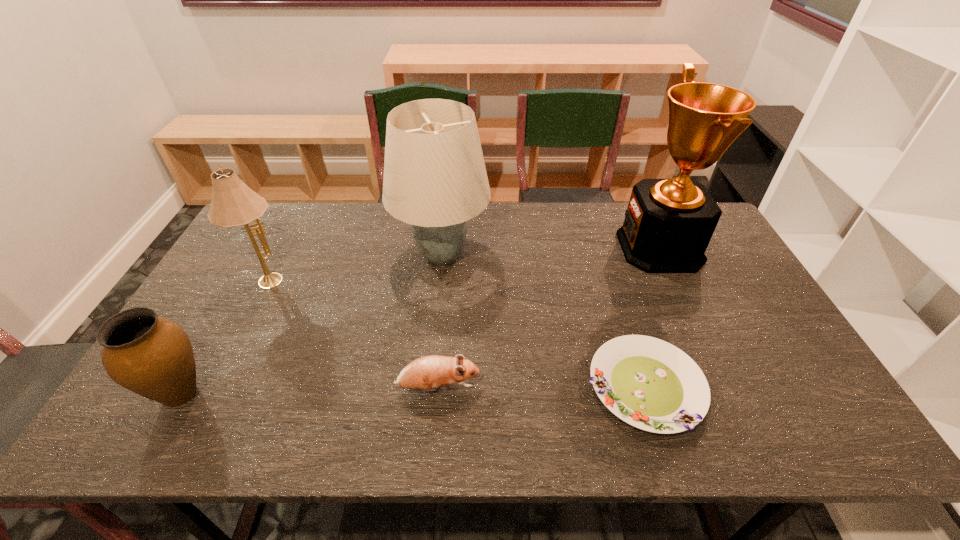
The image size is (960, 540). Identify the location of free point between the taller lampshade and the salad plate. (543, 321).

Find the location of `unoccupied position between the shorter lampshade and the fifth tallest object`. unoccupied position between the shorter lampshade and the fifth tallest object is located at coordinates (352, 333).

Image resolution: width=960 pixels, height=540 pixels. Find the location of `empty location between the shorter lampshade and the taller lampshade`. empty location between the shorter lampshade and the taller lampshade is located at coordinates (354, 267).

Find the location of a particular element. The image size is (960, 540). free space between the trophy cup and the hamster is located at coordinates (548, 318).

I want to click on vacant area that lies between the right lampshade and the third tallest object, so click(354, 267).

Locate an element on the screen. The width and height of the screenshot is (960, 540). free area in between the shortest object and the left lampshade is located at coordinates (456, 333).

Where is `vacant space in between the shortest object and the fifth tallest object`? vacant space in between the shortest object and the fifth tallest object is located at coordinates (541, 387).

At what (x,y) coordinates should I click in order to perform the action: click on free space between the left lampshade and the salad plate. Please return your answer as a coordinate pair (x, y). Looking at the image, I should click on (456, 333).

Find the location of a particular element. The image size is (960, 540). free spot between the shortest object and the trophy cup is located at coordinates (652, 317).

The image size is (960, 540). I want to click on object that is the closest one to the third shortest object, so click(233, 203).